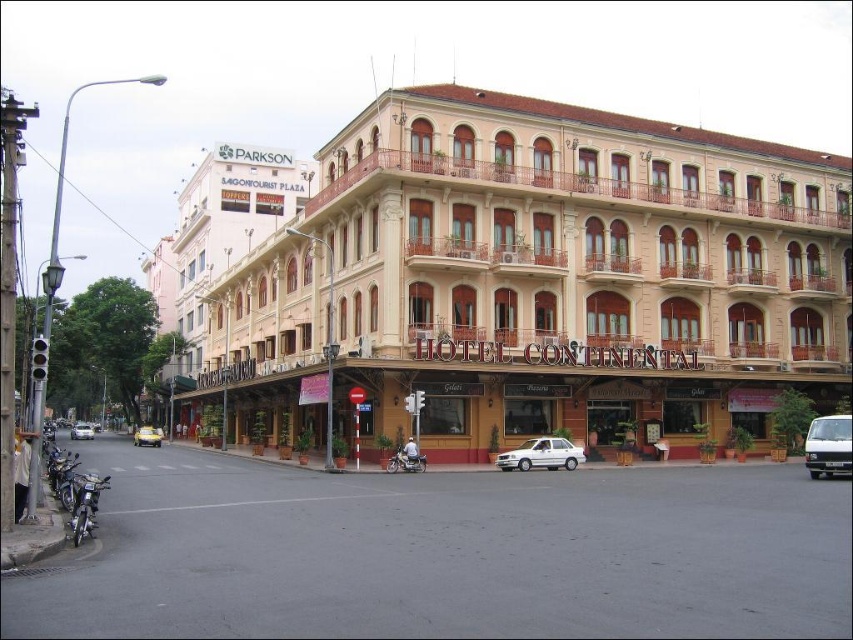
Question: Which of these objects is positioned farthest from the metallic silver motorcycle at lower left?

Choices:
 (A) yellow matte taxi at lower left
 (B) white matte van at center
 (C) beige textured building at center
 (D) silver metallic car at lower left

Answer: (D)

Question: Can you confirm if white matte sedan at center is wider than yellow matte taxi at lower left?

Choices:
 (A) yes
 (B) no

Answer: (B)

Question: Which point is farther to the camera?

Choices:
 (A) yellow matte taxi at lower left
 (B) metallic silver motorcycle at lower left

Answer: (A)

Question: Does white matte van at center have a greater width compared to metallic silver motorcycle at center?

Choices:
 (A) yes
 (B) no

Answer: (A)

Question: Can you confirm if white matte van at center is positioned below metallic silver motorcycle at center?

Choices:
 (A) yes
 (B) no

Answer: (B)

Question: Which object appears farthest from the camera in this image?

Choices:
 (A) beige textured building at center
 (B) white matte sedan at center
 (C) yellow matte taxi at lower left
 (D) white matte van at center

Answer: (C)